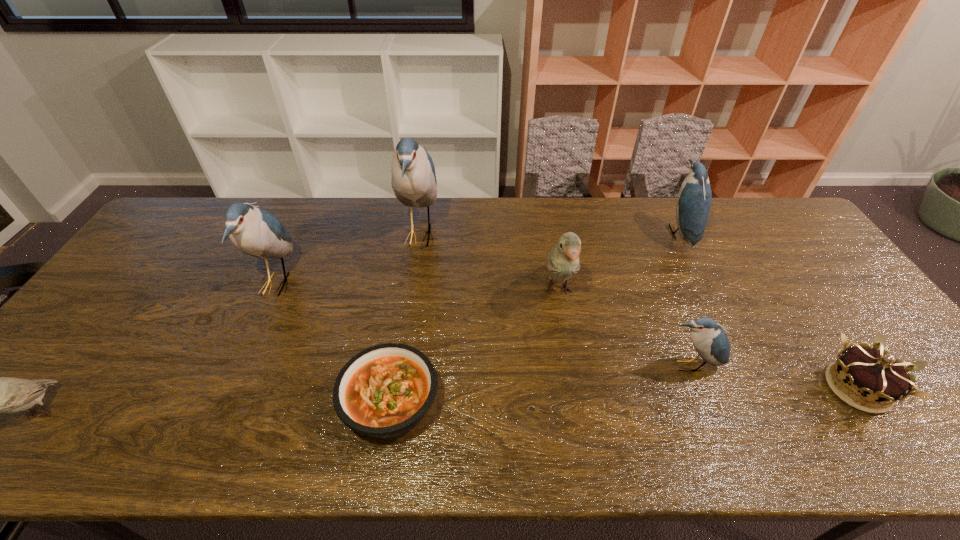
The height and width of the screenshot is (540, 960). I want to click on crown, so click(x=875, y=374).

I want to click on the rightmost object, so click(x=875, y=374).

At what (x,y) coordinates should I click in order to perform the action: click on stew. Please return your answer as a coordinate pair (x, y). The width and height of the screenshot is (960, 540). Looking at the image, I should click on (384, 391).

Locate an element on the screen. vacant region located 0.310m at the tip of the tallest bird's beak is located at coordinates (534, 235).

Where is `vacant space located 0.070m at the tip of the seventh object from right to left's beak`? This screenshot has height=540, width=960. vacant space located 0.070m at the tip of the seventh object from right to left's beak is located at coordinates (319, 284).

This screenshot has width=960, height=540. In order to click on vacant space positioned 0.080m at the tip of the rightmost blue bird's beak in this screenshot , I will do `click(641, 233)`.

Identify the location of free location located 0.240m at the tip of the rightmost blue bird's beak. This screenshot has height=540, width=960. (593, 233).

Where is `vacant region located at the tip of the rightmost blue bird's beak`? The image size is (960, 540). vacant region located at the tip of the rightmost blue bird's beak is located at coordinates (609, 233).

You are a GUI agent. You are given a task and a screenshot of the screen. Output one action in this format:
    pyautogui.click(x=<x>, y=<y>)
    Task: Click on the free space located at the face of the fifth object from left to right
    The width and height of the screenshot is (960, 540).
    Given the screenshot: What is the action you would take?
    pyautogui.click(x=583, y=435)

Locate an element on the screen. The height and width of the screenshot is (540, 960). vacant space situated at the tip of the second nearest bird's beak is located at coordinates (703, 400).